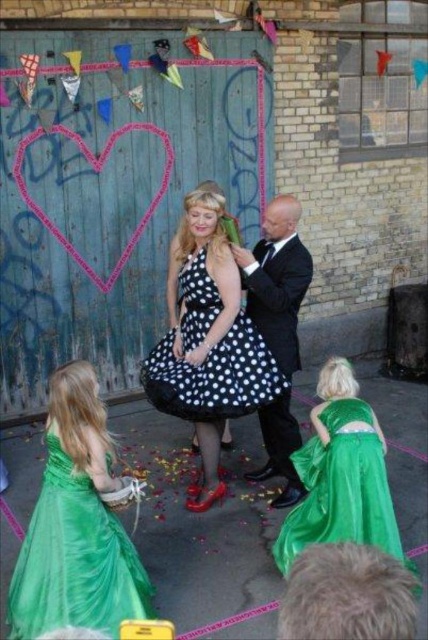
Is black polka dot dress at center taller than shiny black suit at center?

No, black polka dot dress at center is not taller than shiny black suit at center.

Who is more forward, (214,298) or (293,344)?

Point (214,298) is more forward.

The image size is (428, 640). I want to click on black polka dot dress at center, so click(x=214, y=376).

Between green satin dress at lower right and black polka dot dress at center, which one is positioned higher?

black polka dot dress at center is above.

Is green satin dress at lower right to the left of black polka dot dress at center from the viewer's perspective?

Incorrect, green satin dress at lower right is not on the left side of black polka dot dress at center.

This screenshot has width=428, height=640. I want to click on green satin dress at lower right, so click(x=341, y=486).

In order to click on green satin dress at lower right in this screenshot , I will do `click(341, 486)`.

From the picture: Who is taller, green satin dress at lower left or green satin dress at lower right?

green satin dress at lower left

Between green satin dress at lower left and green satin dress at lower right, which one is positioned lower?

green satin dress at lower left is below.

Is point (68, 579) more distant than point (305, 506)?

No.

This screenshot has width=428, height=640. I want to click on green satin dress at lower left, so click(74, 560).